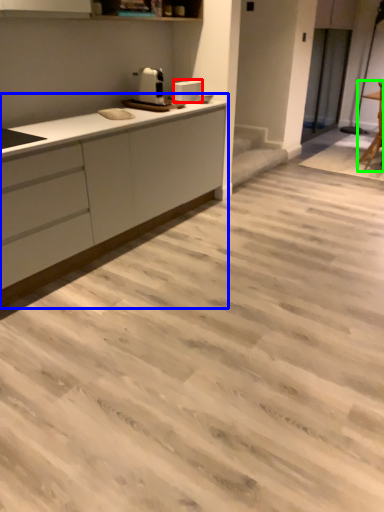
Question: Estimate the real-world distances between objects in this image. Which object is closer to appliance (highlighted by a red box), countertop (highlighted by a blue box) or chair (highlighted by a green box)?

Choices:
 (A) countertop
 (B) chair

Answer: (A)